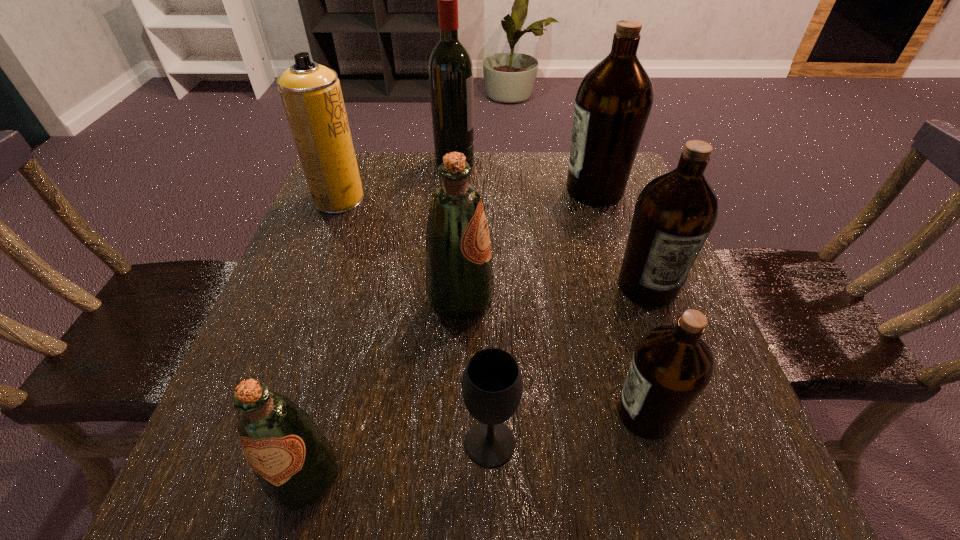
At what (x,y) coordinates should I click in order to perform the action: click on free space that satisfies the following two spatial constraints: 1. on the label of the smallest brown olive oil; 2. on the front-facing side of the smaller green olive oil. Please return your answer as a coordinate pair (x, y). The height and width of the screenshot is (540, 960). Looking at the image, I should click on (663, 477).

Locate an element on the screen. This screenshot has width=960, height=540. vacant area that satisfies the following two spatial constraints: 1. on the label of the nearest brown olive oil; 2. on the front-facing side of the smaller green olive oil is located at coordinates (x=663, y=477).

Where is `blank area in the image that satisfies the following two spatial constraints: 1. on the label of the tallest olive oil; 2. on the front side of the aerosol can`? blank area in the image that satisfies the following two spatial constraints: 1. on the label of the tallest olive oil; 2. on the front side of the aerosol can is located at coordinates (598, 199).